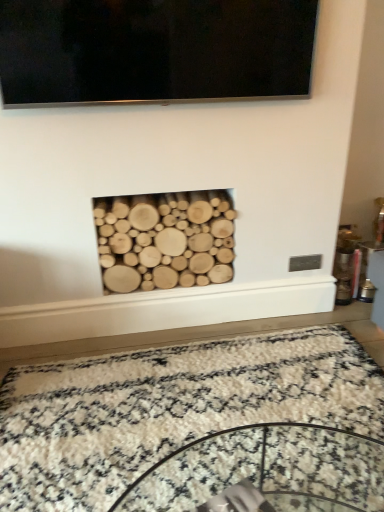
Question: Is point tap(152, 243) positioned closer to the camera than point tap(33, 6)?

Choices:
 (A) closer
 (B) farther

Answer: (B)

Question: From their relative heights in the image, would you say natural wood logs at center is taller or shorter than black glossy flat-screen tv at upper center?

Choices:
 (A) short
 (B) tall

Answer: (B)

Question: Estimate the real-world distances between objects in this image. Which object is closer to the black glossy flat-screen tv at upper center?

Choices:
 (A) white shaggy rug at center
 (B) natural wood logs at center

Answer: (B)

Question: Which is nearer to the natural wood logs at center?

Choices:
 (A) white shaggy rug at center
 (B) black glossy flat-screen tv at upper center

Answer: (A)